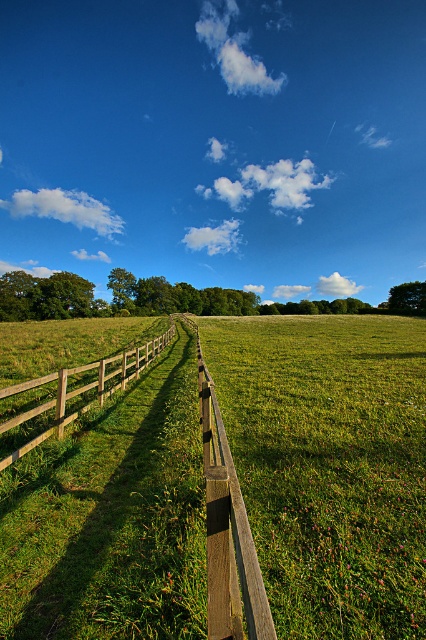
Question: Which point is closer to the camera?

Choices:
 (A) (74, 378)
 (B) (25, 465)

Answer: (B)

Question: Is brown wooden fence at center positioned at the back of brown wooden rail at center?

Choices:
 (A) yes
 (B) no

Answer: (B)

Question: Does brown wooden fence at center come behind brown wooden rail at center?

Choices:
 (A) no
 (B) yes

Answer: (A)

Question: Which object appears farthest from the camera in this image?

Choices:
 (A) brown wooden fence at center
 (B) wooden fence at left

Answer: (B)

Question: Is brown wooden fence at center to the left of wooden fence at left from the viewer's perspective?

Choices:
 (A) yes
 (B) no

Answer: (B)

Question: Which point is farther to the camera?

Choices:
 (A) 95,388
 (B) 23,515

Answer: (A)